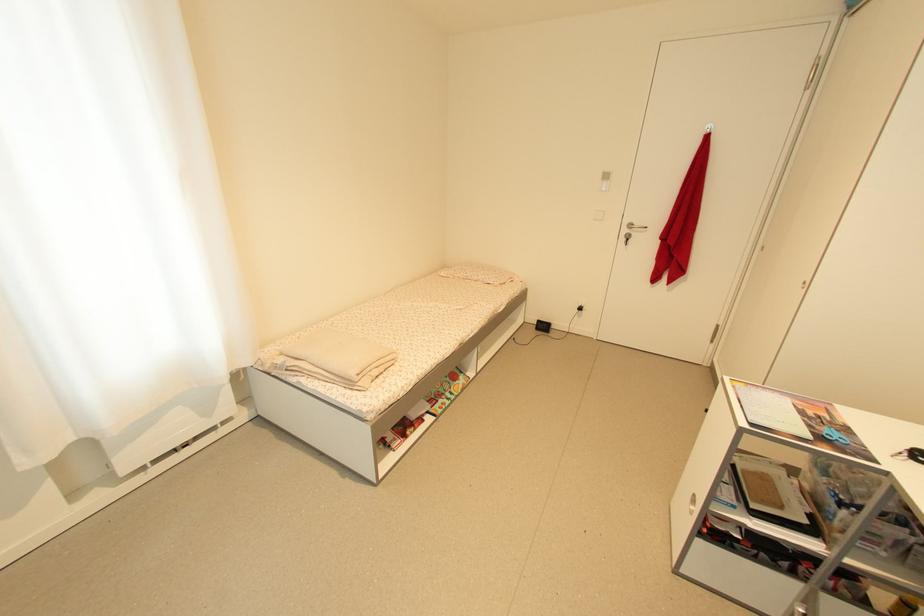
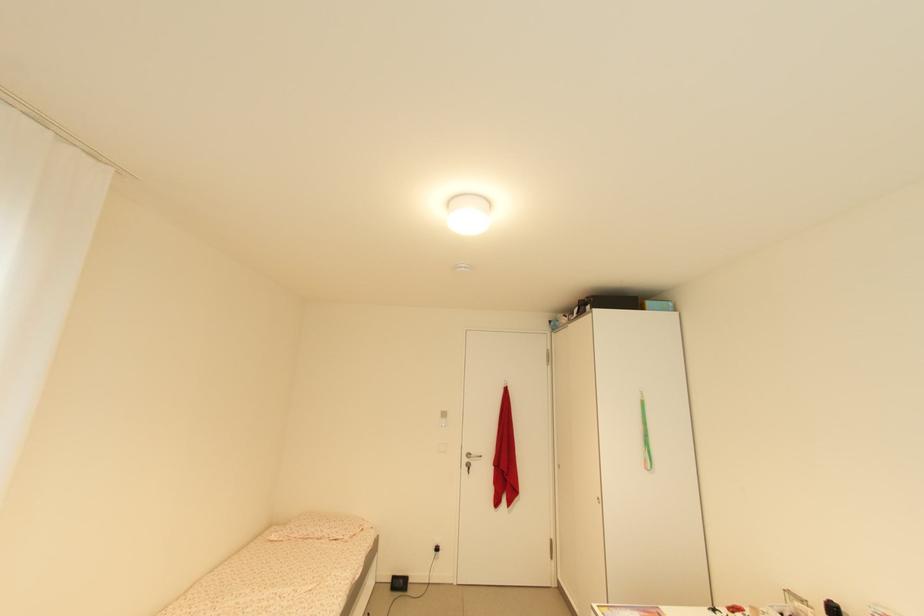
Where in the second image is the point corresponding to (x=636, y=227) from the first image?

(473, 456)